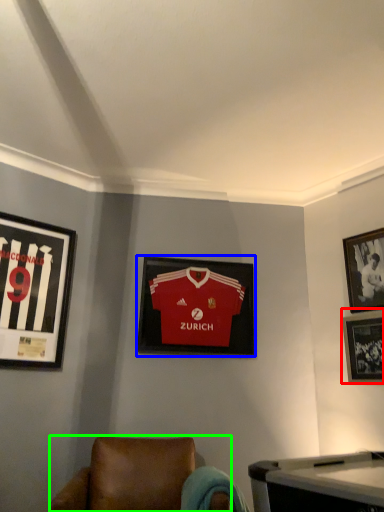
Question: Estimate the real-world distances between objects in this image. Which object is farther from picture frame (highlighted by a red box), picture frame (highlighted by a blue box) or chair (highlighted by a green box)?

Choices:
 (A) picture frame
 (B) chair

Answer: (B)